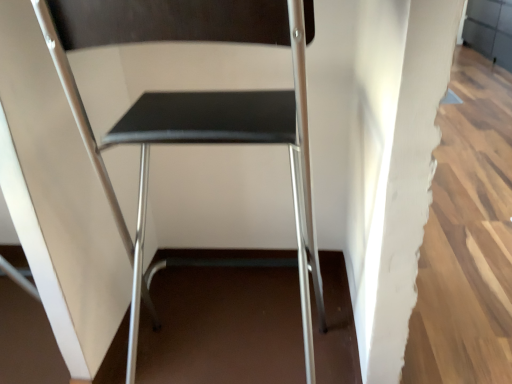
The width and height of the screenshot is (512, 384). I want to click on matte black chair at center, so click(x=197, y=113).

What do you see at coordinates (197, 113) in the screenshot?
I see `matte black chair at center` at bounding box center [197, 113].

The image size is (512, 384). Identify the location of matte black chair at center. (197, 113).